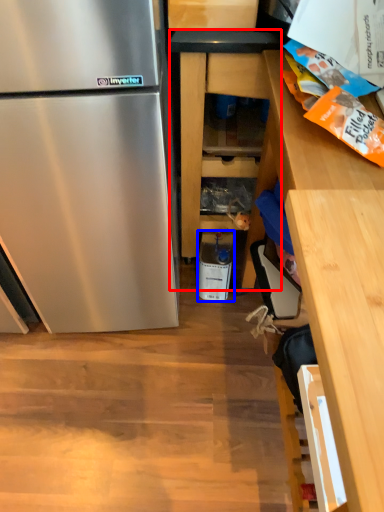
Question: Which object appears farthest to the camera in this image, cabinetry (highlighted by a red box) or appliance (highlighted by a blue box)?

Choices:
 (A) cabinetry
 (B) appliance

Answer: (B)